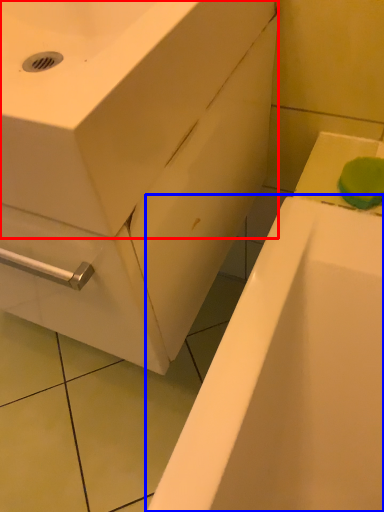
Question: Among these objects, which one is nearest to the camera, sink (highlighted by a red box) or bathtub (highlighted by a blue box)?

Choices:
 (A) sink
 (B) bathtub

Answer: (A)